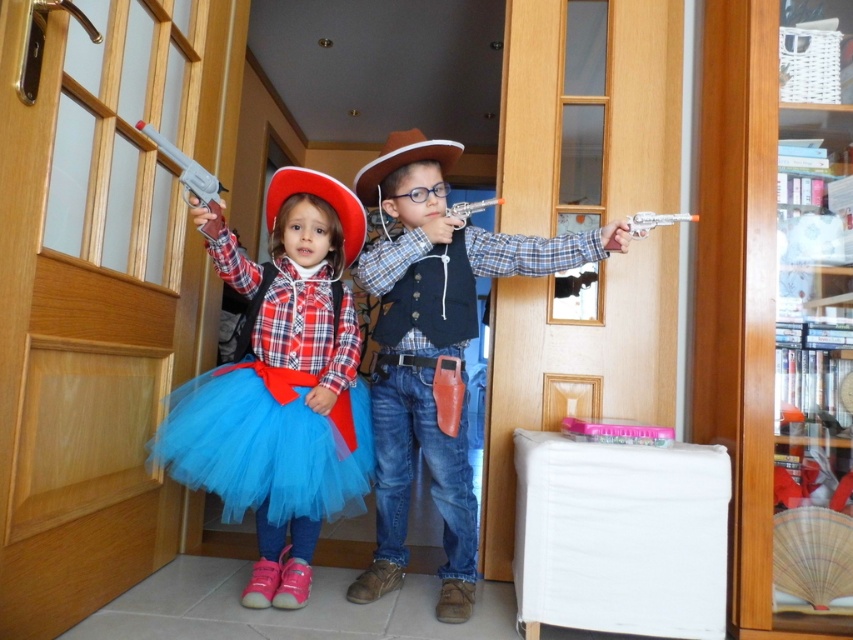
Question: Is matte red hat at upper left above blue tulle ballet skirt at center?

Choices:
 (A) no
 (B) yes

Answer: (B)

Question: Is matte red hat at upper left above blue tulle ballet skirt at center?

Choices:
 (A) yes
 (B) no

Answer: (A)

Question: Estimate the real-world distances between objects in this image. Which object is farther from the matte black vest at center?

Choices:
 (A) matte plastic handgun at upper left
 (B) blue tulle ballet skirt at center

Answer: (A)

Question: Which point is farther to the camera?

Choices:
 (A) matte red hat at upper left
 (B) matte black vest at center

Answer: (B)

Question: Which object is positioned closest to the blue tulle ballet skirt at center?

Choices:
 (A) matte plastic handgun at upper left
 (B) matte red hat at upper left

Answer: (B)

Question: Is matte red hat at upper left to the right of matte plastic handgun at upper left from the viewer's perspective?

Choices:
 (A) no
 (B) yes

Answer: (B)